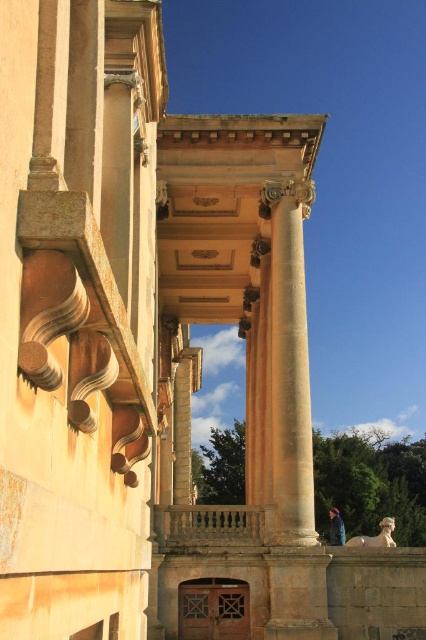
You are an architect visiting this classical building and notice the beige stone column at center and the blue denim jacket at lower right. Which object has a smaller width?

The beige stone column at center has a smaller width than the blue denim jacket at lower right.

You are standing in front of the classical building and want to take a photo of the beige stone column at center. If your camera can capture objects up to 40 meters away, will you be able to capture the entire column in the photo?

The beige stone column at center is 50.00 meters from camera, which is beyond the camera range of 40 meters. Therefore, you cannot capture the entire column in the photo.

You are an architect visiting the classical building and notice the beige stone column at center and the blue denim jacket at lower right. Which object appears bigger in the scene?

The beige stone column at center is larger in size than the blue denim jacket at lower right, so the beige stone column at center appears bigger in the scene.